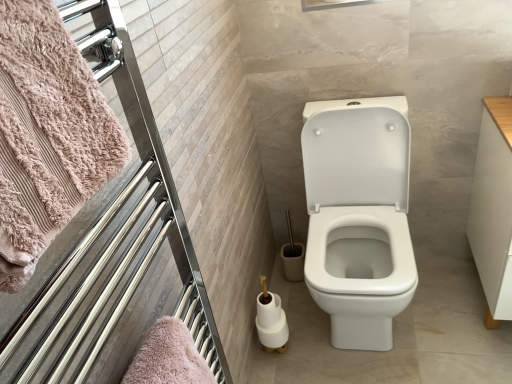
Question: Does white wood drawer at right lie behind chrome metallic towel rack at upper left?

Choices:
 (A) yes
 (B) no

Answer: (A)

Question: Does white wood drawer at right have a greater width compared to chrome metallic towel rack at upper left?

Choices:
 (A) no
 (B) yes

Answer: (B)

Question: Is white wood drawer at right far away from chrome metallic towel rack at upper left?

Choices:
 (A) yes
 (B) no

Answer: (A)

Question: Is white wood drawer at right facing away from chrome metallic towel rack at upper left?

Choices:
 (A) yes
 (B) no

Answer: (B)

Question: Does white wood drawer at right have a larger size compared to chrome metallic towel rack at upper left?

Choices:
 (A) yes
 (B) no

Answer: (A)

Question: Visually, is pink fluffy towel at left positioned to the left or to the right of white glossy toilet paper at lower center, which is the 1th toilet paper in top-to-bottom order?

Choices:
 (A) left
 (B) right

Answer: (A)

Question: From a real-world perspective, is pink fluffy towel at left positioned above or below white glossy toilet paper at lower center, which is the 1th toilet paper in top-to-bottom order?

Choices:
 (A) below
 (B) above

Answer: (B)

Question: In terms of size, does pink fluffy towel at left appear bigger or smaller than white glossy toilet paper at lower center, which is the 1th toilet paper in top-to-bottom order?

Choices:
 (A) big
 (B) small

Answer: (A)

Question: Choose the correct answer: Is pink fluffy towel at left inside white glossy toilet paper at lower center, placed as the 2th toilet paper when sorted from bottom to top, or outside it?

Choices:
 (A) inside
 (B) outside

Answer: (B)

Question: Choose the correct answer: Is chrome metallic towel rack at upper left inside pink fluffy towel at left or outside it?

Choices:
 (A) outside
 (B) inside

Answer: (A)

Question: From a real-world perspective, is chrome metallic towel rack at upper left above or below pink fluffy towel at left?

Choices:
 (A) above
 (B) below

Answer: (B)

Question: Is point (16, 319) positioned closer to the camera than point (20, 94)?

Choices:
 (A) farther
 (B) closer

Answer: (A)

Question: In terms of size, does chrome metallic towel rack at upper left appear bigger or smaller than pink fluffy towel at left?

Choices:
 (A) big
 (B) small

Answer: (A)

Question: Based on their sizes in the image, would you say white wood drawer at right is bigger or smaller than white glossy toilet paper at lower center, the 2th toilet paper in the top-to-bottom sequence?

Choices:
 (A) small
 (B) big

Answer: (B)

Question: Is white wood drawer at right inside or outside of white glossy toilet paper at lower center, the 2th toilet paper in the top-to-bottom sequence?

Choices:
 (A) outside
 (B) inside

Answer: (A)